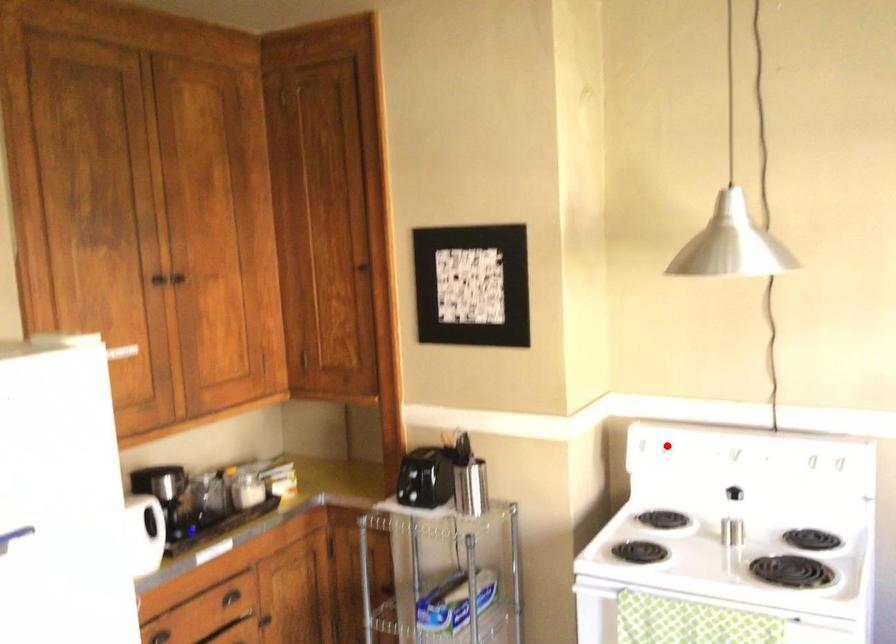
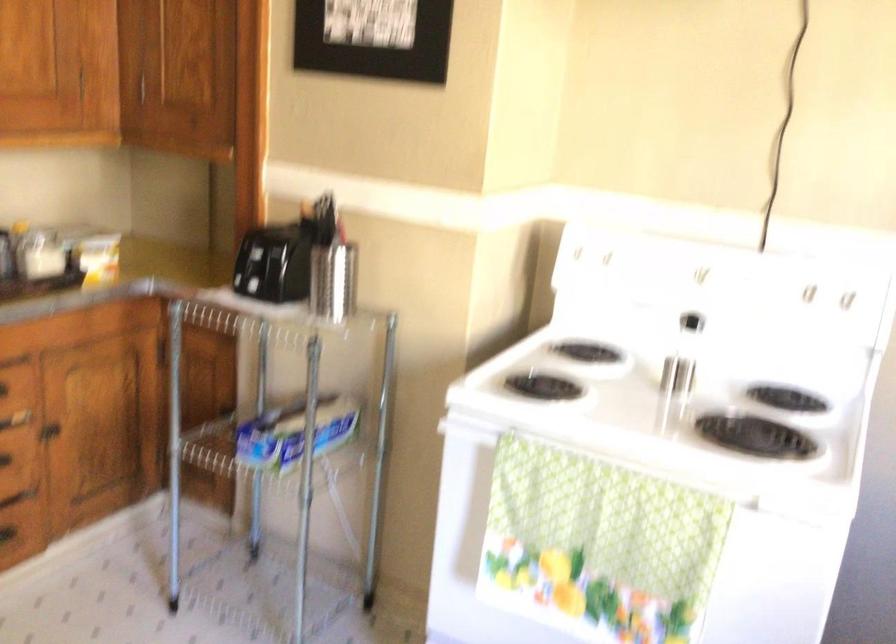
Question: I am providing you with two images of the same scene from different viewpoints. A red point is shown in image1. For the corresponding object point in image2, is it positioned nearer or farther from the camera?

Choices:
 (A) Nearer
 (B) Farther

Answer: (A)